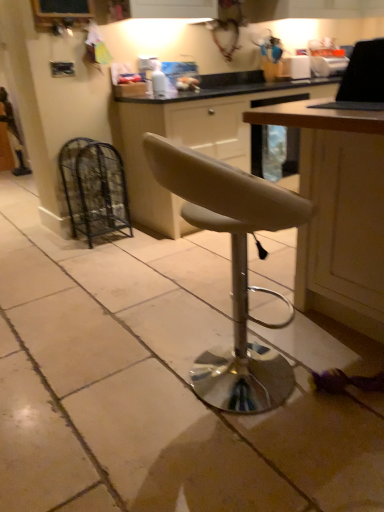
Question: Would you say black wire mesh cage at left is to the left or to the right of beige leather stool at center in the picture?

Choices:
 (A) right
 (B) left

Answer: (B)

Question: Is point (107, 226) closer or farther from the camera than point (279, 372)?

Choices:
 (A) closer
 (B) farther

Answer: (B)

Question: Which object is positioned farthest from the black wire mesh cage at left?

Choices:
 (A) black glossy laptop at upper right
 (B) matte beige cabinet at center
 (C) beige leather stool at center
 (D) wooden table at right

Answer: (A)

Question: Considering the real-world distances, which object is farthest from the black wire mesh cage at left?

Choices:
 (A) black glossy laptop at upper right
 (B) matte beige cabinet at center
 (C) wooden table at right
 (D) beige leather stool at center

Answer: (A)